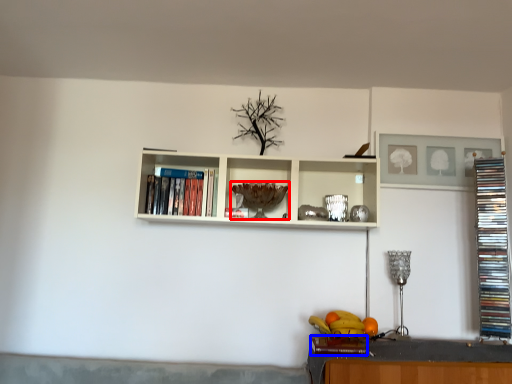
Question: Which of the following is the closest to the observer, wine glass (highlighted by a red box) or book (highlighted by a blue box)?

Choices:
 (A) wine glass
 (B) book

Answer: (B)